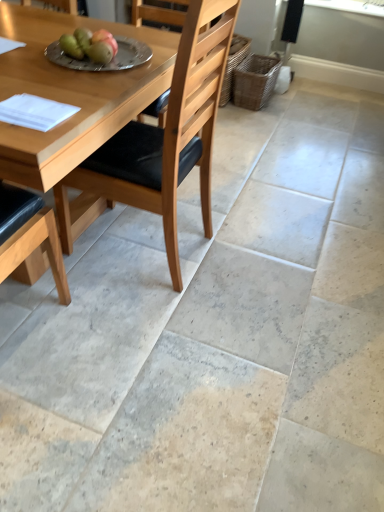
The image size is (384, 512). Find the location of `vacant space in front of light brown wood chair at center`. vacant space in front of light brown wood chair at center is located at coordinates (147, 332).